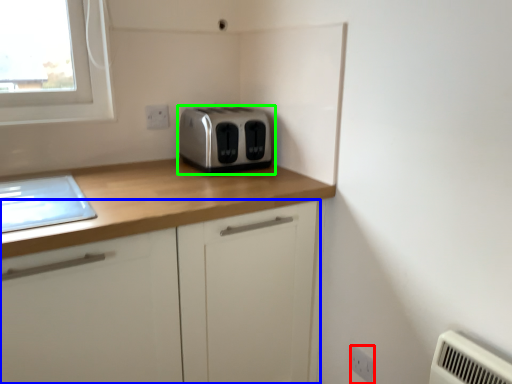
Question: Which object is positioned closest to electric outlet (highlighted by a red box)? Select from cabinetry (highlighted by a blue box) and toaster (highlighted by a green box).

Choices:
 (A) cabinetry
 (B) toaster

Answer: (A)